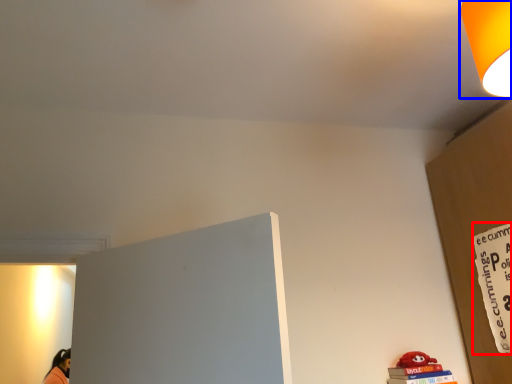
Question: Among these objects, which one is nearest to the camera, warning sign (highlighted by a red box) or lamp (highlighted by a blue box)?

Choices:
 (A) warning sign
 (B) lamp

Answer: (B)